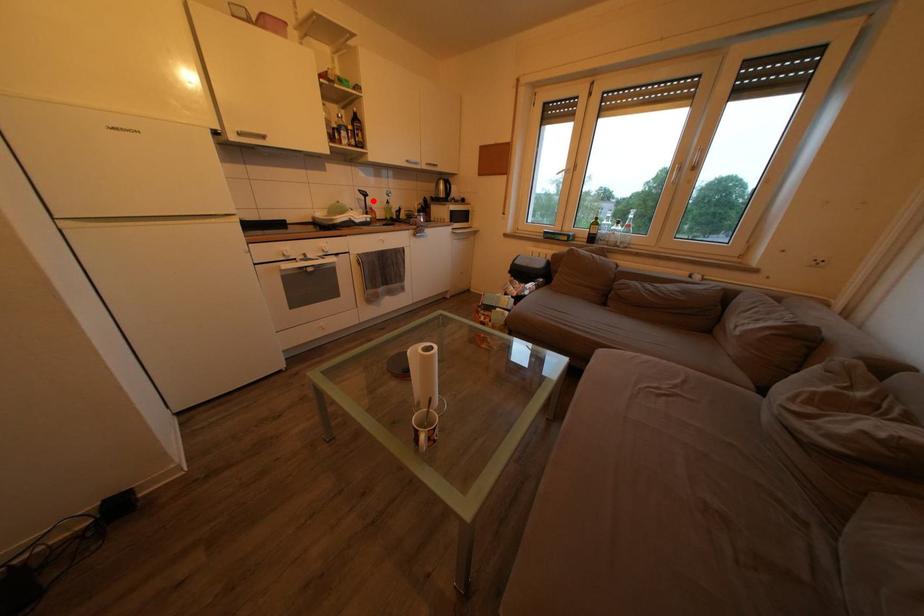
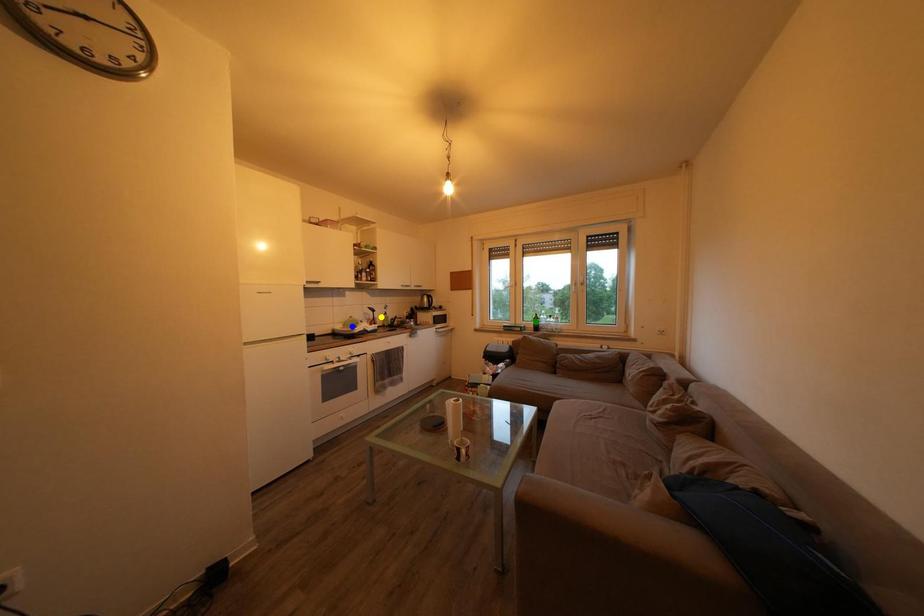
Question: I am providing you with two images of the same scene from different viewpoints. A red point is marked on the first image. You are given multiple points on the second image. Which mark in image 2 goes with the point in image 1?

Choices:
 (A) green point
 (B) yellow point
 (C) blue point

Answer: (B)